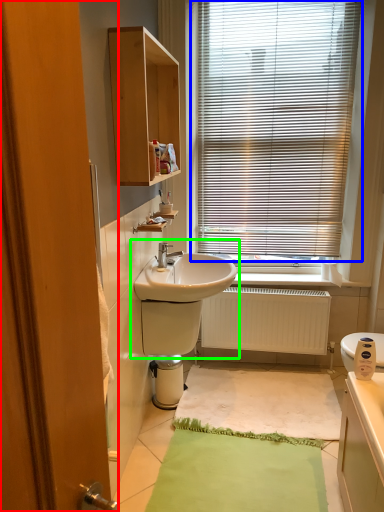
Question: Considering the real-world distances, which object is closest to screen door (highlighted by a red box)? window blind (highlighted by a blue box) or sink (highlighted by a green box).

Choices:
 (A) window blind
 (B) sink

Answer: (B)